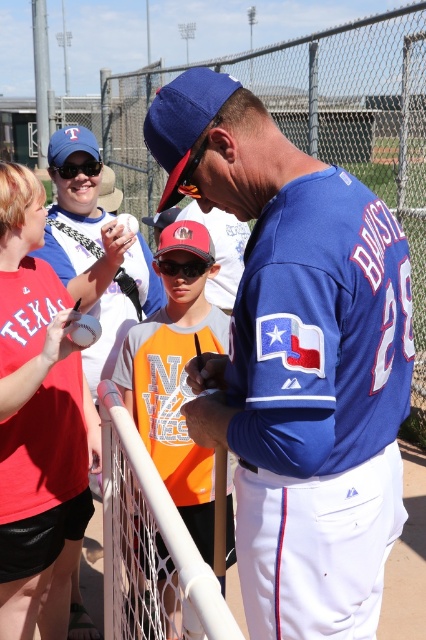
Question: From the image, what is the correct spatial relationship of blue jersey at center in relation to black plastic goggles at upper left?

Choices:
 (A) below
 (B) above

Answer: (A)

Question: Which of the following is the farthest from the observer?

Choices:
 (A) orange jersey at center
 (B) black plastic goggles at upper left

Answer: (B)

Question: Which point appears farthest from the camera in this image?

Choices:
 (A) (68, 161)
 (B) (167, 259)

Answer: (A)

Question: Is matte white baseball cap at upper left wider than black plastic goggles at center?

Choices:
 (A) no
 (B) yes

Answer: (B)

Question: Estimate the real-world distances between objects in this image. Which object is closer to the black plastic goggles at upper left?

Choices:
 (A) black plastic goggles at center
 (B) orange jersey at center
 (C) orange jersey at left

Answer: (A)

Question: Is blue jersey at center positioned at the back of matte white baseball cap at upper left?

Choices:
 (A) no
 (B) yes

Answer: (A)